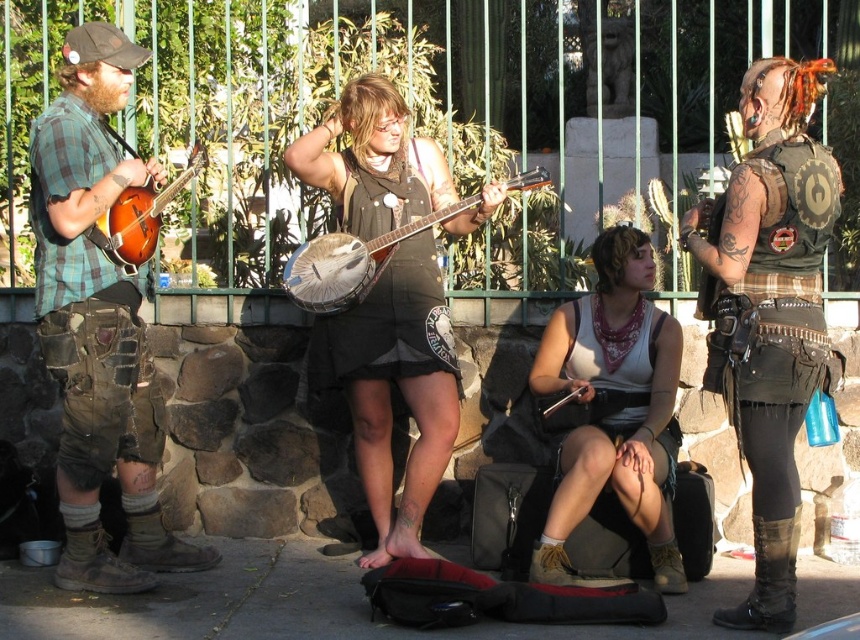
Is steampunk leather vest at center thinner than matte brown banjo at left?

No.

Between steampunk leather vest at center and matte brown banjo at left, which one appears on the left side from the viewer's perspective?

Positioned to the left is matte brown banjo at left.

Does point (793, 172) come farther from viewer compared to point (108, 244)?

No, (793, 172) is in front of (108, 244).

Identify the location of steampunk leather vest at center. Image resolution: width=860 pixels, height=640 pixels. (769, 310).

Between point (647, 536) and point (449, 209), which one is positioned in front?

Point (647, 536) is in front.

Is point (670, 321) closer to camera compared to point (345, 288)?

No, (670, 321) is further to viewer.

Find the location of `white fabric tank top at center`. white fabric tank top at center is located at coordinates (613, 406).

Identify the location of white fabric tank top at center. (613, 406).

Is matte plaid shirt at left to the left of steampunk leather vest at center from the viewer's perspective?

Yes, matte plaid shirt at left is to the left of steampunk leather vest at center.

Does matte plaid shirt at left have a lesser height compared to steampunk leather vest at center?

No, matte plaid shirt at left is not shorter than steampunk leather vest at center.

Describe the element at coordinates (97, 326) in the screenshot. I see `matte plaid shirt at left` at that location.

Where is `matte plaid shirt at left`? matte plaid shirt at left is located at coordinates (97, 326).